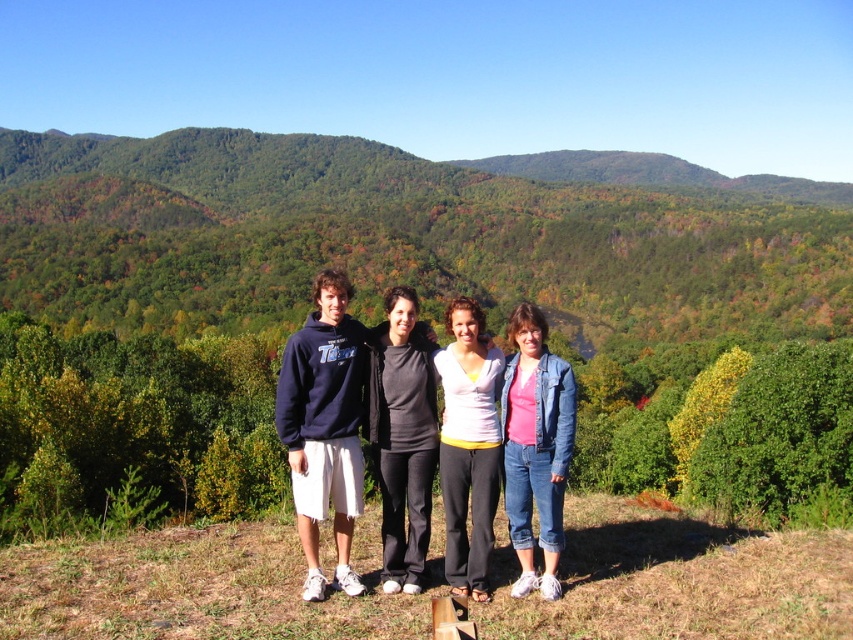
Question: Which point is closer to the camera taking this photo?

Choices:
 (A) (399, 515)
 (B) (473, 518)

Answer: (B)

Question: Which is nearer to the pink denim jacket at lower right?

Choices:
 (A) green leafy hillside at center
 (B) dark blue hoodie at center
 (C) black matte pants at center
 (D) white cotton shirt at center

Answer: (D)

Question: Is green leafy hillside at center to the right of dark blue hoodie at center from the viewer's perspective?

Choices:
 (A) yes
 (B) no

Answer: (B)

Question: Which of the following is the closest to the observer?

Choices:
 (A) dark blue hoodie at center
 (B) green leafy hillside at center
 (C) pink denim jacket at lower right
 (D) white cotton shirt at center

Answer: (D)

Question: Is black matte pants at center wider than dark blue hoodie at center?

Choices:
 (A) no
 (B) yes

Answer: (A)

Question: Is pink denim jacket at lower right above white cotton shirt at center?

Choices:
 (A) no
 (B) yes

Answer: (B)